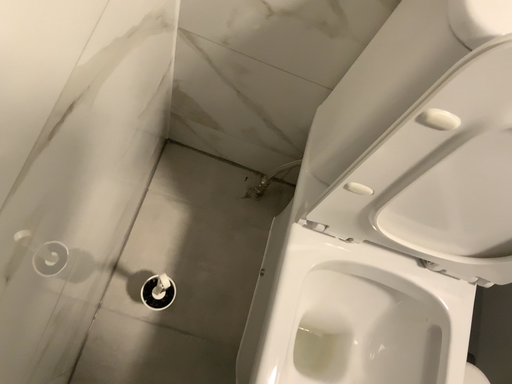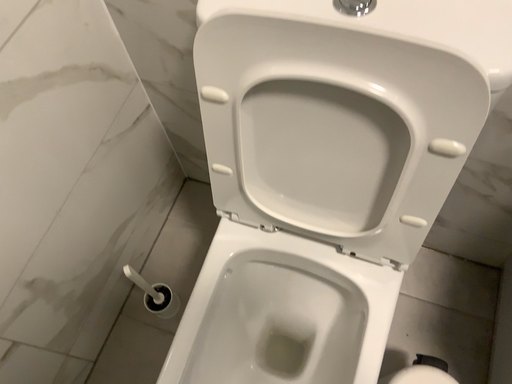
Question: Which way did the camera rotate in the video?

Choices:
 (A) rotated right
 (B) rotated left

Answer: (B)